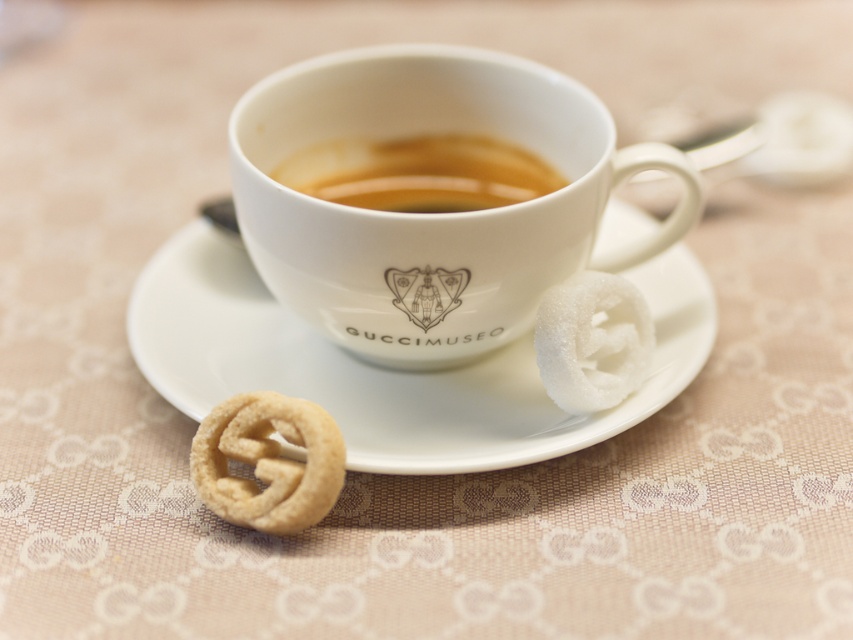
You are arranging items on a table and need to place a decorative item between the white porcelain cup at center and the white ceramic saucer at center. Based on their positions, where should you place the decorative item?

The white porcelain cup at center is to the right of the white ceramic saucer at center, so you should place the decorative item between them on the left side of the cup and the right side of the saucer.

You are looking at the image of a Gucci Museum cup and saucer set. There are two points marked in the image. Which point is closer to you, point [299,68] or point [666,330]?

Point [299,68] is closer to the viewer than point [666,330].